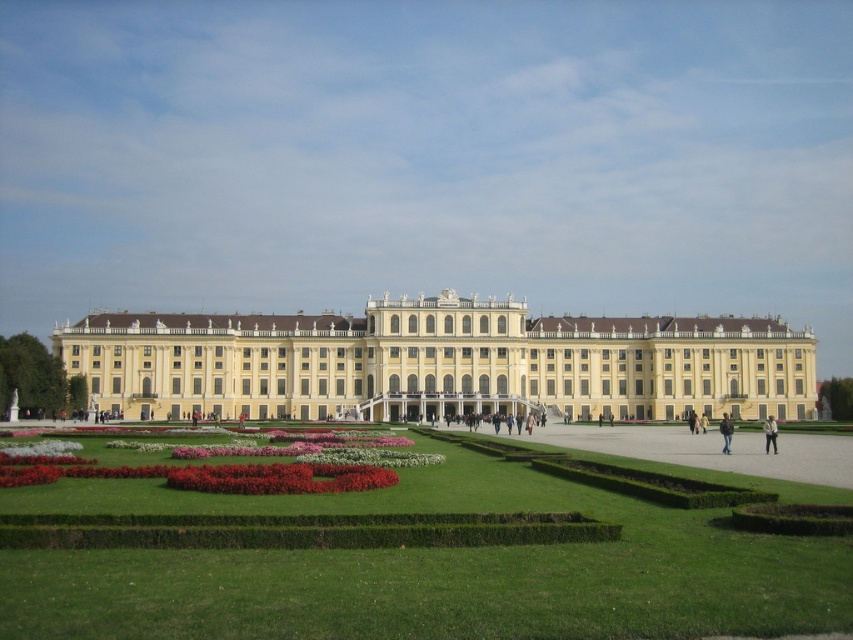
Question: Which point is farther to the camera?

Choices:
 (A) white cotton shirt at center
 (B) green grass at center
 (C) brown leather jacket at center

Answer: (C)

Question: Is green grass at center wider than yellow matte building at center?

Choices:
 (A) yes
 (B) no

Answer: (B)

Question: Observing the image, what is the correct spatial positioning of yellow matte building at center in reference to white cotton shirt at center?

Choices:
 (A) left
 (B) right

Answer: (A)

Question: Which point appears farthest from the camera in this image?

Choices:
 (A) (718, 429)
 (B) (57, 401)
 (C) (569, 596)
 (D) (393, 404)

Answer: (A)

Question: Estimate the real-world distances between objects in this image. Which object is closer to the green hedge at left?

Choices:
 (A) yellow matte building at center
 (B) white cotton shirt at center
 (C) brown leather jacket at center
 (D) green grass at center

Answer: (A)

Question: Is green hedge at left wider than white cotton shirt at center?

Choices:
 (A) no
 (B) yes

Answer: (B)